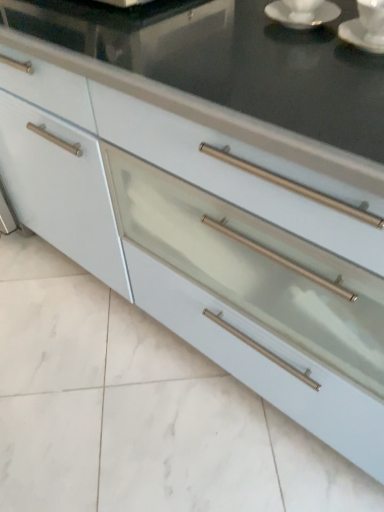
Question: Is white glossy saucer at upper right, which appears as the second saucer when viewed from the right, shorter than satin white drawer at center?

Choices:
 (A) no
 (B) yes

Answer: (A)

Question: Is satin white drawer at center located within white glossy saucer at upper right, which appears as the second saucer when viewed from the right?

Choices:
 (A) yes
 (B) no

Answer: (B)

Question: Is there a large distance between white glossy saucer at upper right, which appears as the second saucer when viewed from the right, and satin white drawer at center?

Choices:
 (A) yes
 (B) no

Answer: (B)

Question: Does white glossy saucer at upper right, which is counted as the first saucer, starting from the left, have a smaller size compared to satin white drawer at center?

Choices:
 (A) no
 (B) yes

Answer: (B)

Question: Considering the relative sizes of white glossy saucer at upper right, which is counted as the first saucer, starting from the left, and satin white drawer at center in the image provided, is white glossy saucer at upper right, which is counted as the first saucer, starting from the left, taller than satin white drawer at center?

Choices:
 (A) yes
 (B) no

Answer: (A)

Question: Does white glossy saucer at upper right, which appears as the second saucer when viewed from the right, have a greater width compared to satin white drawer at center?

Choices:
 (A) no
 (B) yes

Answer: (A)

Question: Is white ceramic saucer at upper right, which is the second saucer in left-to-right order, surrounding satin white drawer at center?

Choices:
 (A) yes
 (B) no

Answer: (B)

Question: Can you confirm if white ceramic saucer at upper right, which is the second saucer in left-to-right order, is positioned to the left of satin white drawer at center?

Choices:
 (A) no
 (B) yes

Answer: (A)

Question: Does white ceramic saucer at upper right, the 1th saucer viewed from the right, have a greater height compared to satin white drawer at center?

Choices:
 (A) no
 (B) yes

Answer: (A)

Question: Does white ceramic saucer at upper right, which is the second saucer in left-to-right order, have a lesser width compared to satin white drawer at center?

Choices:
 (A) yes
 (B) no

Answer: (A)

Question: Is white ceramic saucer at upper right, the 1th saucer viewed from the right, outside of satin white drawer at center?

Choices:
 (A) yes
 (B) no

Answer: (A)

Question: Considering the relative positions of white ceramic saucer at upper right, which is the second saucer in left-to-right order, and satin white drawer at center in the image provided, is white ceramic saucer at upper right, which is the second saucer in left-to-right order, behind satin white drawer at center?

Choices:
 (A) no
 (B) yes

Answer: (A)

Question: Is white ceramic saucer at upper right, which is the second saucer in left-to-right order, oriented towards white glossy saucer at upper right?

Choices:
 (A) yes
 (B) no

Answer: (B)